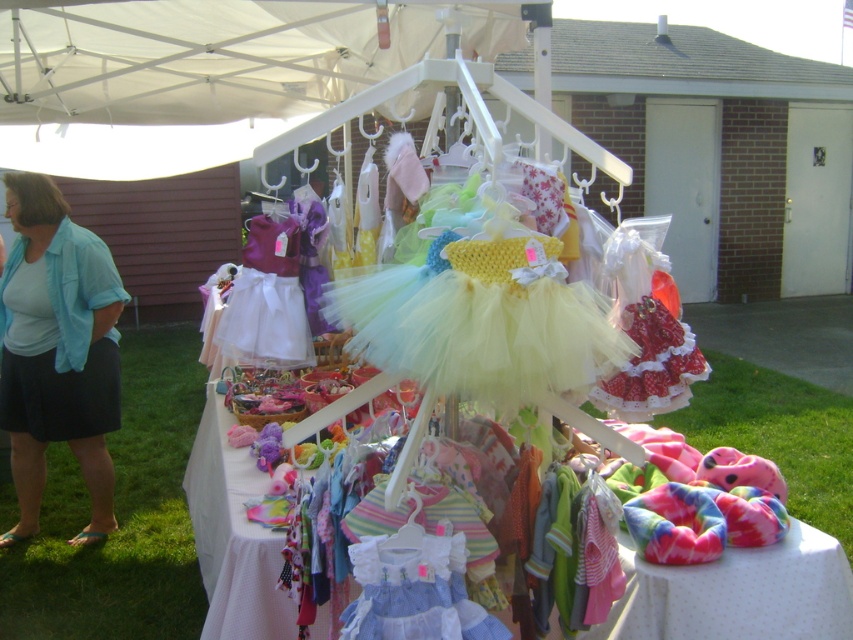
Question: Can you confirm if pastel tulle dress at center is wider than blue cotton shirt at left?

Choices:
 (A) no
 (B) yes

Answer: (A)

Question: Among these objects, which one is nearest to the camera?

Choices:
 (A) pastel tulle dress at center
 (B) blue cotton shirt at left

Answer: (A)

Question: Is the position of pastel tulle dress at center less distant than that of blue cotton shirt at left?

Choices:
 (A) no
 (B) yes

Answer: (B)

Question: Which point appears closest to the camera in this image?

Choices:
 (A) [53, 435]
 (B) [434, 259]

Answer: (B)

Question: Can you confirm if pastel tulle dress at center is wider than blue cotton shirt at left?

Choices:
 (A) no
 (B) yes

Answer: (A)